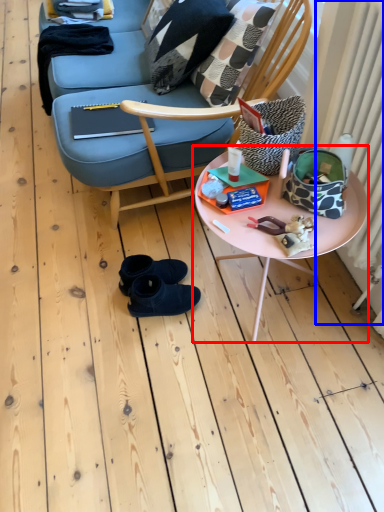
Question: Which point is closer to the camera, table (highlighted by a red box) or radiator (highlighted by a blue box)?

Choices:
 (A) table
 (B) radiator

Answer: (B)